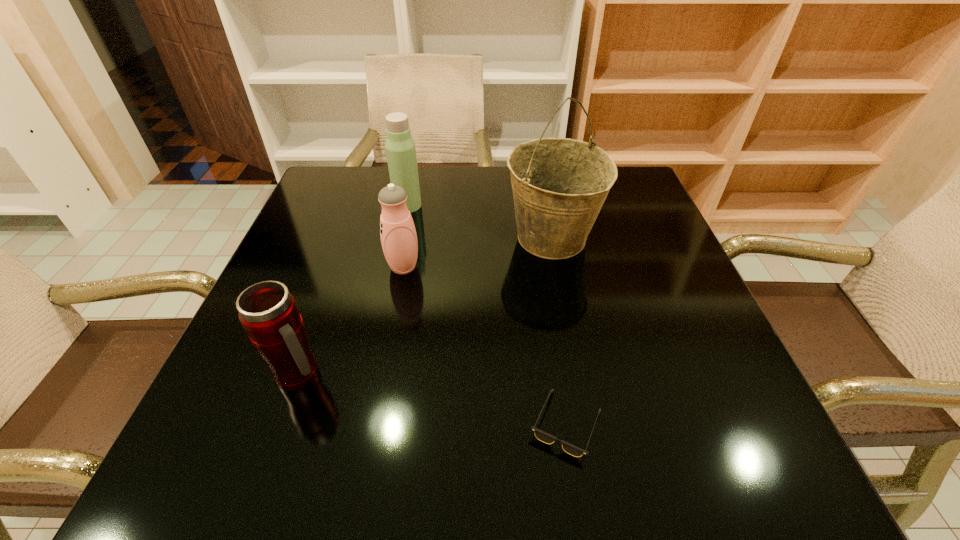
Identify which thermos bottle is the closest to the farthest thermos bottle. Please provide its 2D coordinates. Your answer should be formatted as a tuple, i.e. [(x, y)], where the tuple contains the x and y coordinates of a point satisfying the conditions above.

[(398, 235)]

Where is `thermos bottle that is the closest one to the second nearest thermos bottle`? The image size is (960, 540). thermos bottle that is the closest one to the second nearest thermos bottle is located at coordinates (400, 147).

Identify the location of vacant space that satisfies the following two spatial constraints: 1. on the front side of the tallest object; 2. on the side with the handle of the leftmost object. The image size is (960, 540). (577, 375).

Identify the location of free location that satisfies the following two spatial constraints: 1. on the front side of the tallest object; 2. on the left side of the farthest thermos bottle. This screenshot has width=960, height=540. (401, 239).

Where is `free space that satisfies the following two spatial constraints: 1. on the front side of the farthest thermos bottle; 2. on the side with the handle of the nearest thermos bottle`? free space that satisfies the following two spatial constraints: 1. on the front side of the farthest thermos bottle; 2. on the side with the handle of the nearest thermos bottle is located at coordinates (372, 375).